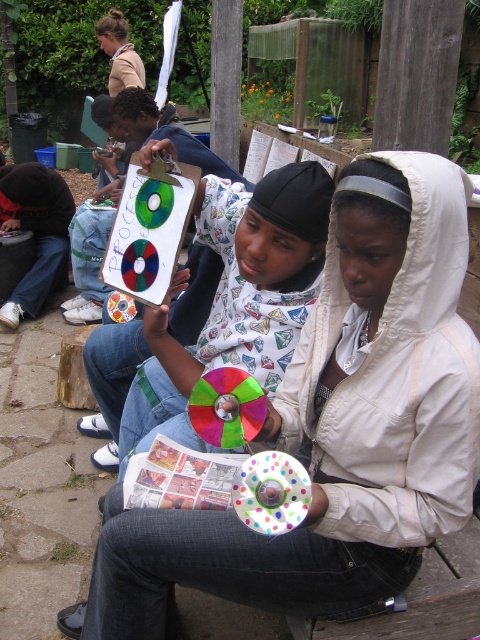
Question: Does white matte hoodie at center have a lesser width compared to light brown leather jacket at upper left?

Choices:
 (A) no
 (B) yes

Answer: (A)

Question: Which of the following is the farthest from the observer?

Choices:
 (A) (393, 177)
 (B) (95, 435)

Answer: (B)

Question: Is white matte hoodie at center further to the viewer compared to light brown leather jacket at upper left?

Choices:
 (A) yes
 (B) no

Answer: (B)

Question: Which point is farther to the camera?

Choices:
 (A) matte plastic cd at center
 (B) light brown leather jacket at upper left
 (C) white matte hoodie at center

Answer: (B)

Question: Does matte plastic cd at center appear on the left side of light brown leather jacket at upper left?

Choices:
 (A) no
 (B) yes

Answer: (A)

Question: Which point is closer to the camera taking this photo?

Choices:
 (A) (204, 348)
 (B) (115, 19)
 (C) (415, 470)

Answer: (C)